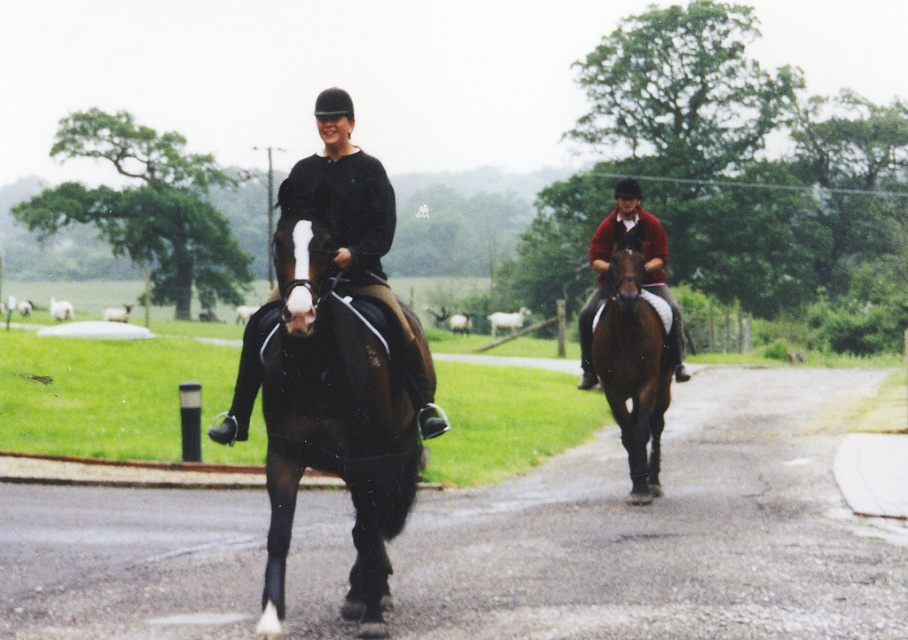
Can you confirm if shiny dark brown horse at center is smaller than brown glossy horse at center?

Incorrect, shiny dark brown horse at center is not smaller in size than brown glossy horse at center.

Is shiny dark brown horse at center shorter than brown glossy horse at center?

No, shiny dark brown horse at center is not shorter than brown glossy horse at center.

Between point (294, 500) and point (637, 300), which one is positioned in front?

Point (294, 500)

The width and height of the screenshot is (908, 640). In order to click on shiny dark brown horse at center in this screenshot , I will do `click(332, 416)`.

Is shiny dark brown horse at center to the right of black leather jacket at center from the viewer's perspective?

No, shiny dark brown horse at center is not to the right of black leather jacket at center.

Is point (383, 371) positioned in front of point (390, 205)?

Yes, it is.

Identify the location of shiny dark brown horse at center. (332, 416).

Does brown glossy horse at center have a greater height compared to red woolen sweater at center?

No.

Is brown glossy horse at center to the right of red woolen sweater at center from the viewer's perspective?

Incorrect, brown glossy horse at center is not on the right side of red woolen sweater at center.

Is point (600, 337) behind point (579, 321)?

No, (600, 337) is closer to viewer.

Where is `brown glossy horse at center`? The height and width of the screenshot is (640, 908). brown glossy horse at center is located at coordinates (633, 369).